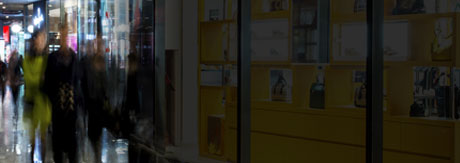
The width and height of the screenshot is (460, 163). Find the location of `glass cases`. glass cases is located at coordinates (x=147, y=52), (x=228, y=64), (x=300, y=75), (x=400, y=71).